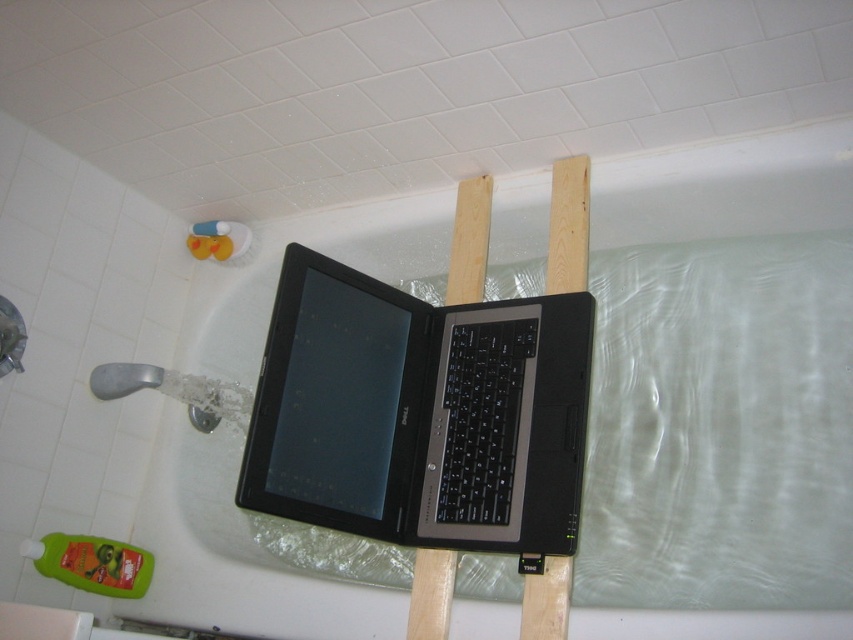
Looking at this image, you are a plumber inspecting the bathroom. You notice the clear plastic bath at upper center and the wooden plank at upper center. Which object is positioned lower in the image?

The clear plastic bath at upper center is positioned below the wooden plank at upper center, so it is lower.

You are a delivery person who needs to place a package that is 36 inches long on the clear plastic bath at upper center. Can the package fit on the bath without overhanging the edges?

The clear plastic bath at upper center is 36.30 inches away from the camera. Since the package is 36 inches long, it can fit on the bath as the distance is slightly longer than the package.

You are setting up a laptop in a bathroom. The black matte laptop at center is placed on the wooden plank at upper center. Considering their heights, which object would you need to adjust to ensure the laptop screen is at a comfortable viewing angle?

The wooden plank at upper center needs to be adjusted because the black matte laptop at center is taller than the wooden plank at upper center, so raising or adding support under the plank could help achieve a comfortable viewing angle.